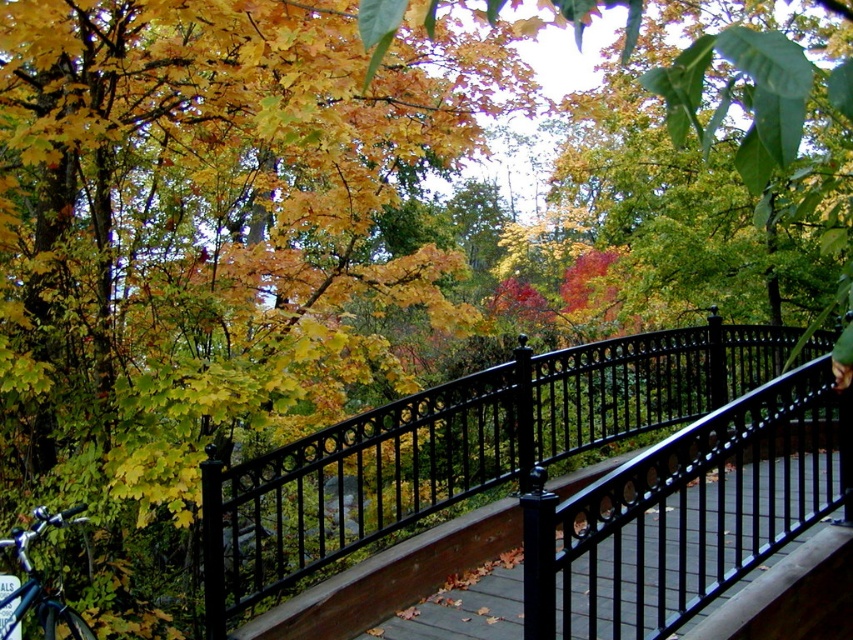
Question: Is the position of black wrought iron fence at center more distant than that of shiny blue bicycle at lower left?

Choices:
 (A) no
 (B) yes

Answer: (B)

Question: Can you confirm if black wrought iron fence at center is positioned above shiny blue bicycle at lower left?

Choices:
 (A) no
 (B) yes

Answer: (B)

Question: Which point is farther to the camera?

Choices:
 (A) (399, 484)
 (B) (27, 561)

Answer: (A)

Question: Among these objects, which one is nearest to the camera?

Choices:
 (A) black wrought iron fence at center
 (B) shiny blue bicycle at lower left

Answer: (B)

Question: Is black wrought iron fence at center positioned behind shiny blue bicycle at lower left?

Choices:
 (A) no
 (B) yes

Answer: (B)